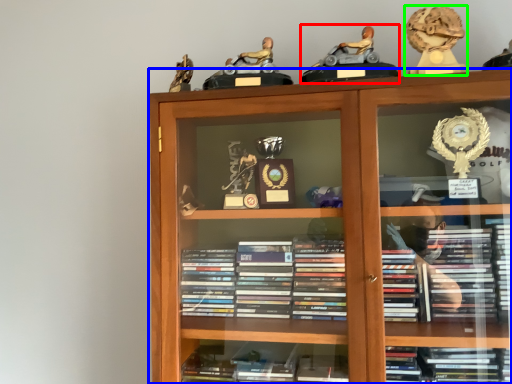
Question: Which object is the farthest from toy (highlighted by a red box)? Choose among these: bookcase (highlighted by a blue box) or toy (highlighted by a green box).

Choices:
 (A) bookcase
 (B) toy

Answer: (A)